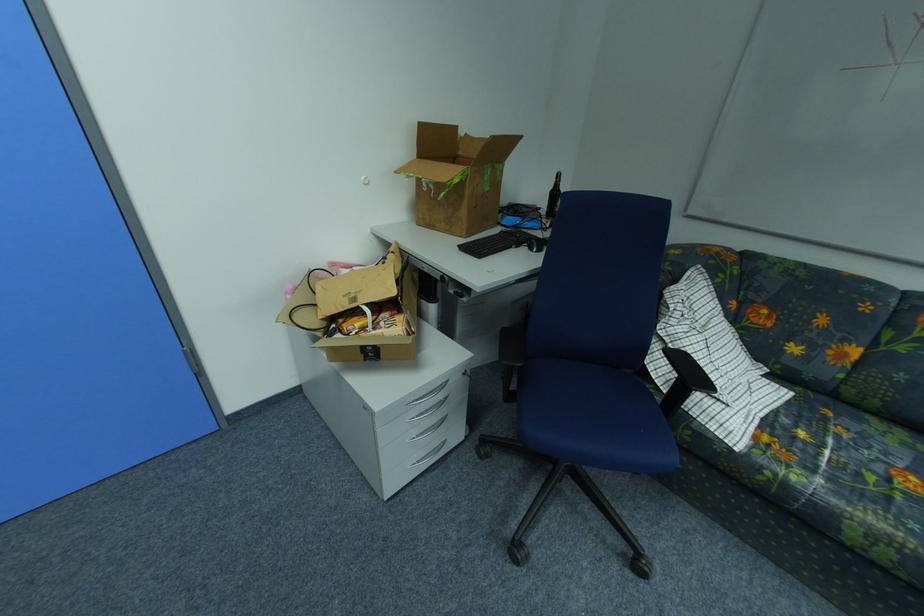
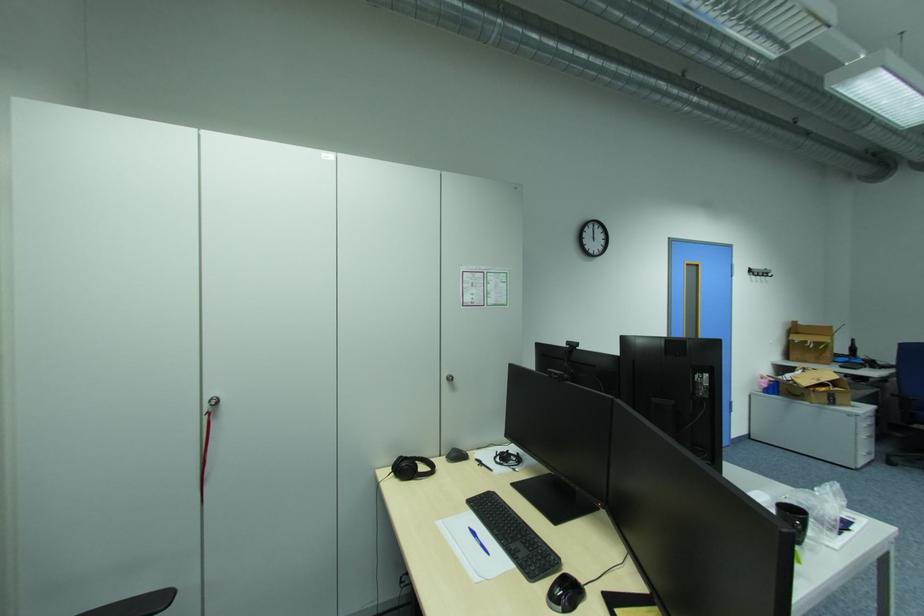
Where in the second image is the point corresponding to point 469,132 from the first image?

(808, 323)